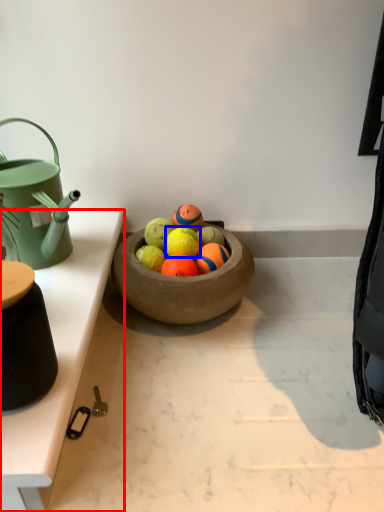
Question: Which object is further to the camera taking this photo, table (highlighted by a red box) or fruit (highlighted by a blue box)?

Choices:
 (A) table
 (B) fruit

Answer: (B)